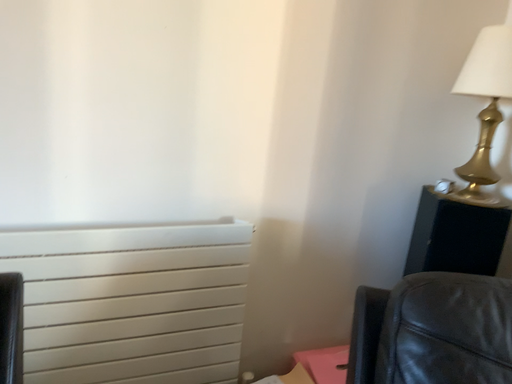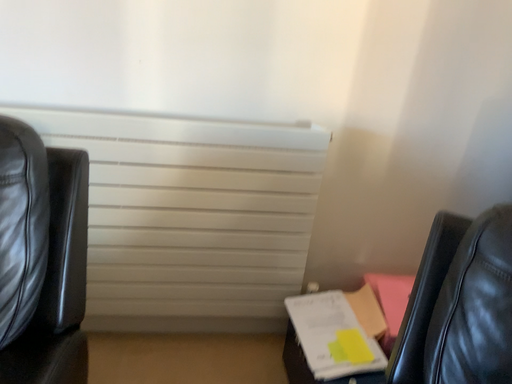
Question: How did the camera likely rotate when shooting the video?

Choices:
 (A) rotated upward
 (B) rotated downward

Answer: (B)